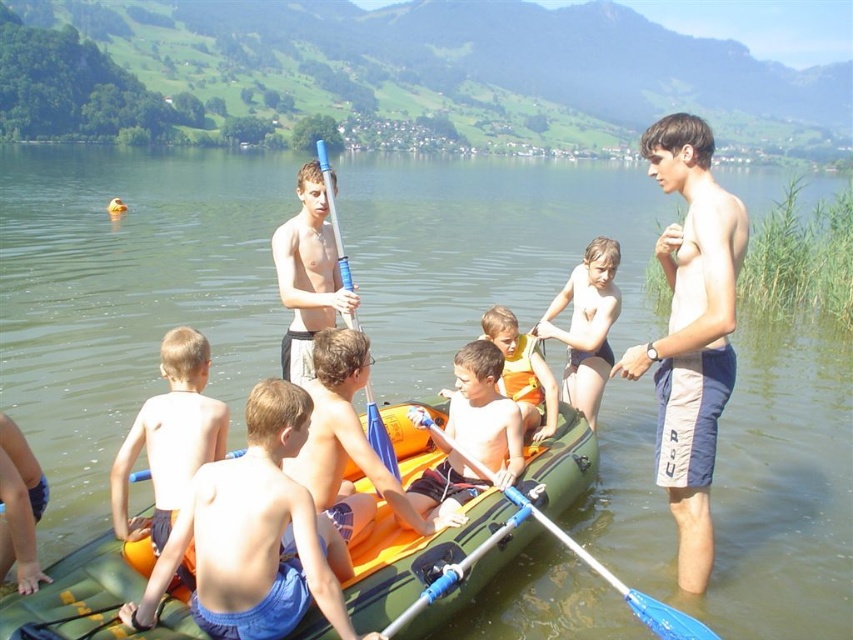
Question: Does skinny white shorts at center have a larger size compared to matte black swimsuit at center?

Choices:
 (A) no
 (B) yes

Answer: (B)

Question: Which object appears farthest from the camera in this image?

Choices:
 (A) orange rubber kayak at lower left
 (B) orange rubber boat at center

Answer: (B)

Question: Estimate the real-world distances between objects in this image. Which object is farther from the orange rubber boat at center?

Choices:
 (A) orange life vest at center
 (B) orange rubber kayak at lower left
 (C) matte black swimsuit at center
 (D) matte blue paddle at center

Answer: (C)

Question: Can you confirm if orange life vest at center is wider than matte black swimsuit at center?

Choices:
 (A) no
 (B) yes

Answer: (B)

Question: Does green rubber boat at center appear under blue plastic paddle at center?

Choices:
 (A) yes
 (B) no

Answer: (A)

Question: Which of the following is the closest to the observer?

Choices:
 (A) orange life vest at center
 (B) green rubber boat at center
 (C) orange rubber boat at center

Answer: (B)